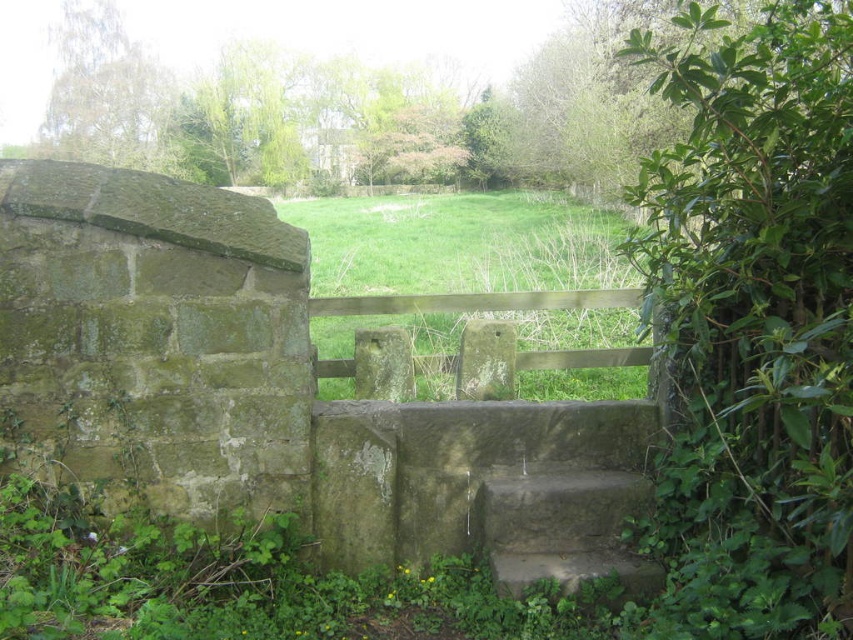
Question: Which object is closer to the camera taking this photo?

Choices:
 (A) stone textured stair at center
 (B) brown wooden rail at center
 (C) green grass at center
 (D) green mossy stone wall at left

Answer: (D)

Question: Which point appears closest to the camera in this image?

Choices:
 (A) (262, 260)
 (B) (553, 292)
 (C) (384, 257)

Answer: (A)

Question: Is green grass at center below stone textured stair at center?

Choices:
 (A) no
 (B) yes

Answer: (A)

Question: Is stone textured stair at center thinner than brown wooden rail at center?

Choices:
 (A) yes
 (B) no

Answer: (A)

Question: Which of the following is the closest to the observer?

Choices:
 (A) stone textured stair at center
 (B) green mossy stone wall at left
 (C) brown wooden rail at center
 (D) green grass at center

Answer: (B)

Question: Is green mossy stone wall at left to the left of green grass at center from the viewer's perspective?

Choices:
 (A) yes
 (B) no

Answer: (B)